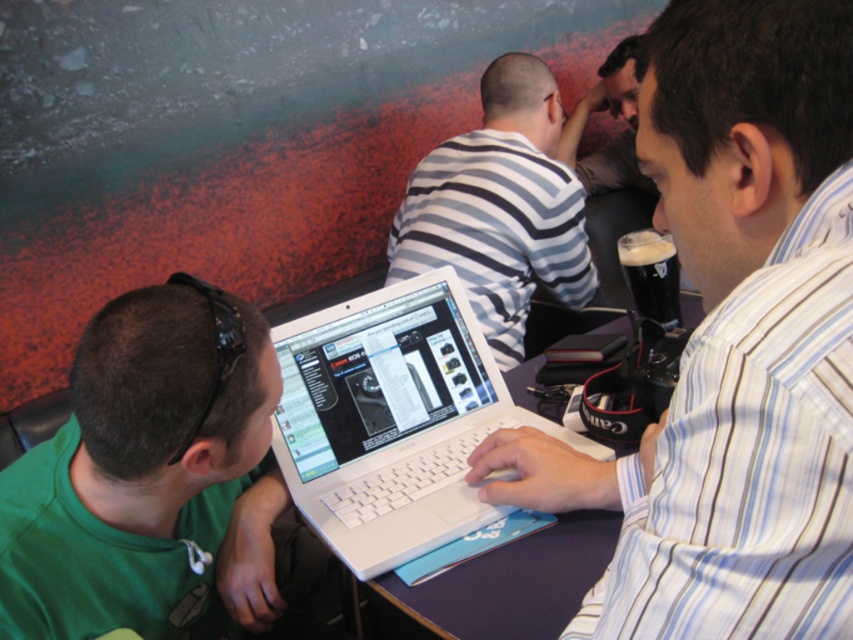
Question: Does white glossy laptop at center lie in front of green matte shirt at lower left?

Choices:
 (A) no
 (B) yes

Answer: (B)

Question: Which point is farther to the camera?

Choices:
 (A) (798, 332)
 (B) (422, 531)

Answer: (B)

Question: Is white plastic laptop at center further to the viewer compared to striped cotton shirt at center?

Choices:
 (A) no
 (B) yes

Answer: (A)

Question: Among these points, which one is farthest from the camera?

Choices:
 (A) (76, 520)
 (B) (664, 536)
 (C) (436, 285)
 (D) (483, 266)

Answer: (D)

Question: Which point appears farthest from the camera in this image?

Choices:
 (A) (349, 380)
 (B) (578, 460)

Answer: (A)

Question: Is white glossy laptop at center positioned before green matte shirt at lower left?

Choices:
 (A) no
 (B) yes

Answer: (B)